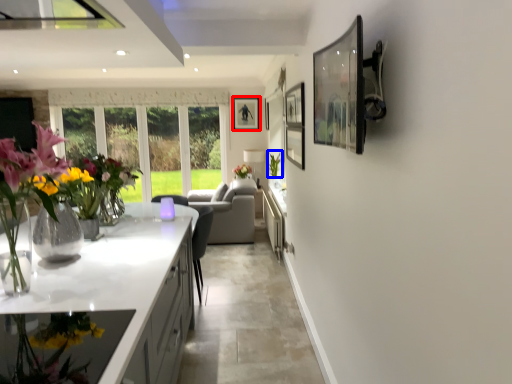
Question: Among these objects, which one is farthest to the camera, picture frame (highlighted by a red box) or plant (highlighted by a blue box)?

Choices:
 (A) picture frame
 (B) plant

Answer: (A)